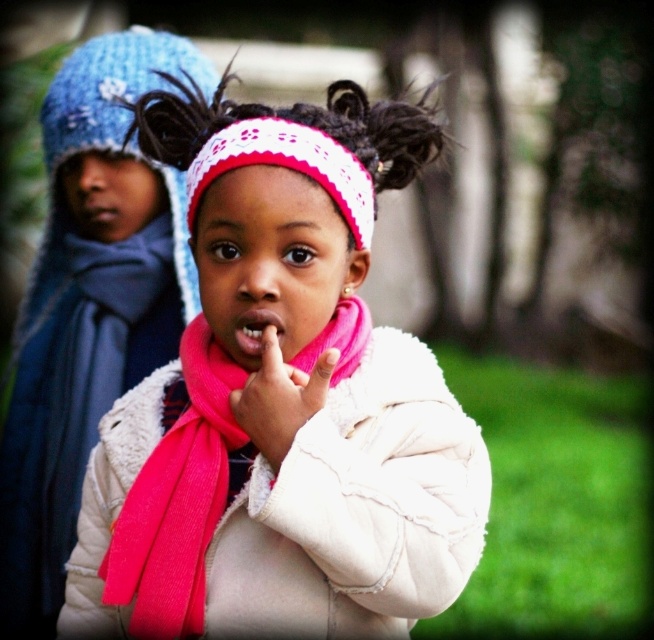
Does pink fleece jacket at center appear on the right side of pink fleece scarf at upper center?

Correct, you'll find pink fleece jacket at center to the right of pink fleece scarf at upper center.

Based on the photo, which of these two, pink fleece jacket at center or pink fleece scarf at upper center, stands shorter?

Standing shorter between the two is pink fleece jacket at center.

Is point (181, 467) more distant than point (29, 480)?

No, it is not.

You are a GUI agent. You are given a task and a screenshot of the screen. Output one action in this format:
    pyautogui.click(x=<x>, y=<y>)
    Task: Click on the pink fleece jacket at center
    
    Given the screenshot: What is the action you would take?
    pyautogui.click(x=281, y=403)

Between pink fabric scarf at center and pink fabric hand at center, which one appears on the left side from the viewer's perspective?

pink fabric scarf at center is more to the left.

Does point (173, 458) come in front of point (273, 444)?

That is False.

You are a GUI agent. You are given a task and a screenshot of the screen. Output one action in this format:
    pyautogui.click(x=<x>, y=<y>)
    Task: Click on the pink fabric scarf at center
    The width and height of the screenshot is (654, 640).
    Given the screenshot: What is the action you would take?
    pyautogui.click(x=177, y=500)

Between point (271, 396) and point (105, 198), which one is positioned in front?

Point (271, 396) is more forward.

Can you confirm if pink fabric hand at center is positioned below matte blue mouth at upper left?

Indeed, pink fabric hand at center is positioned under matte blue mouth at upper left.

Describe the element at coordinates (279, 397) in the screenshot. I see `pink fabric hand at center` at that location.

Where is `pink fabric hand at center`? The image size is (654, 640). pink fabric hand at center is located at coordinates (279, 397).